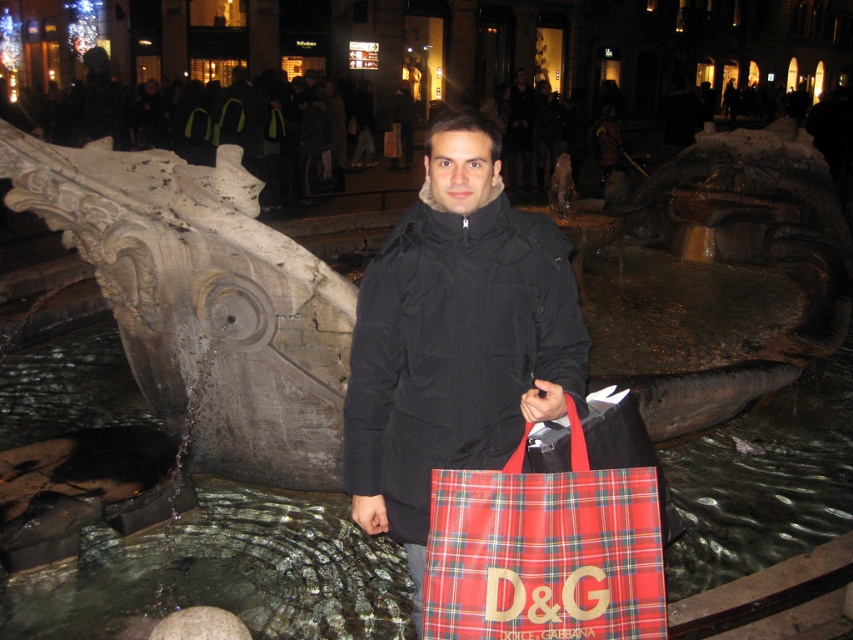
Question: Which point appears closest to the camera in this image?

Choices:
 (A) (515, 262)
 (B) (578, 428)

Answer: (B)

Question: Which of the following is the farthest from the observer?

Choices:
 (A) (577, 346)
 (B) (451, 595)

Answer: (A)

Question: Is black matte coat at center in front of red plaid fabric shopping bag at center?

Choices:
 (A) yes
 (B) no

Answer: (B)

Question: Is black matte coat at center closer to the viewer compared to red plaid fabric shopping bag at center?

Choices:
 (A) no
 (B) yes

Answer: (A)

Question: Which object appears closest to the camera in this image?

Choices:
 (A) black matte coat at center
 (B) red plaid fabric shopping bag at center

Answer: (B)

Question: Is black matte coat at center bigger than red plaid fabric shopping bag at center?

Choices:
 (A) no
 (B) yes

Answer: (B)